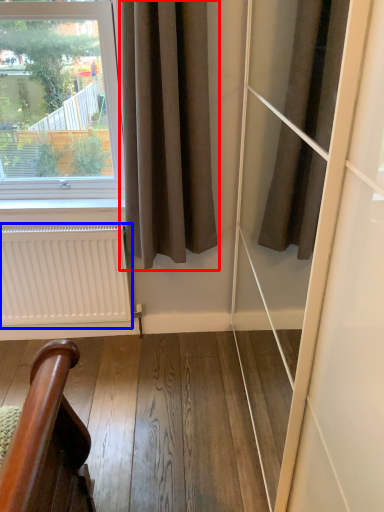
Question: Which point is closer to the camera, curtain (highlighted by a red box) or radiator (highlighted by a blue box)?

Choices:
 (A) curtain
 (B) radiator

Answer: (A)